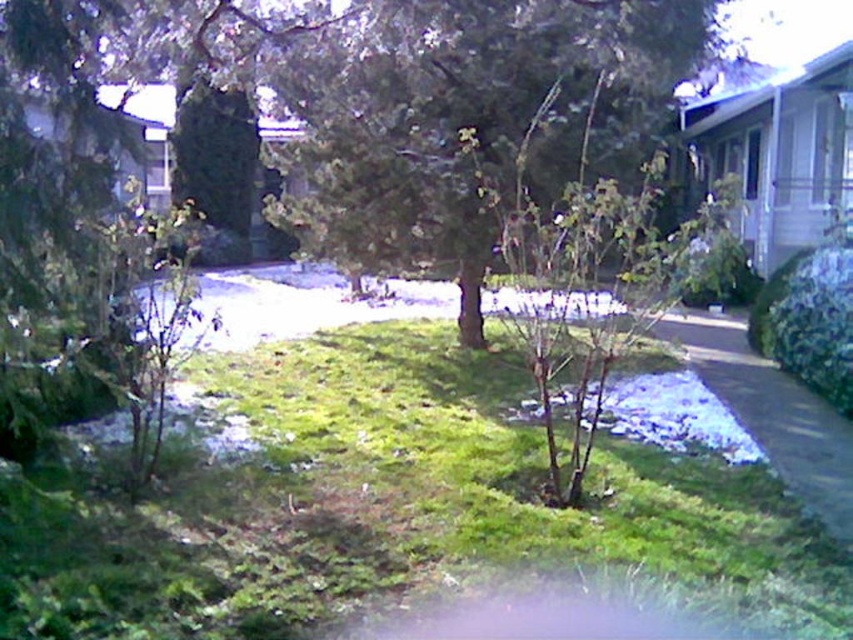
You are a gardener planning to plant a new flower bed. You have two spots available in the scene. One is on the green grass at center and the other is near the green textured tree at center. Considering the size of the areas, which location would allow for a larger flower bed?

The green textured tree at center has a larger size compared to the green grass at center, so the area near the green textured tree at center would allow for a larger flower bed.

You are a gardener who wants to plant a new flower bed between the green grass at center and the green textured tree at center. Based on their positions, which side of the tree should you choose to place the flower bed?

The green grass at center is positioned on the left side of the green textured tree at center, so you should place the flower bed to the left side of the green textured tree at center to ensure it is between both objects.

You are a gardener who wants to plant a new flower bed. You have a small flower pot that needs to be placed between the green grass at center and the green textured tree at center. Based on their positions, where should you place the flower pot?

The green grass at center is positioned under the green textured tree at center, so you should place the flower pot between them, ensuring it is above the green grass at center and below the green textured tree at center to fit their spatial arrangement.